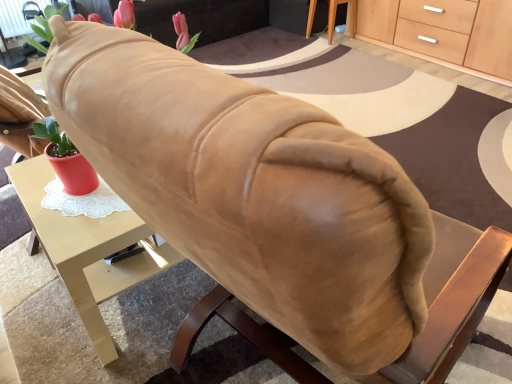
Question: Is suede-like beige couch at upper center oriented towards light wood/wooden cabinet at upper right?

Choices:
 (A) yes
 (B) no

Answer: (A)

Question: Is suede-like beige couch at upper center beside light wood/wooden cabinet at upper right?

Choices:
 (A) no
 (B) yes

Answer: (A)

Question: From the image's perspective, is suede-like beige couch at upper center located above light wood/wooden cabinet at upper right?

Choices:
 (A) no
 (B) yes

Answer: (B)

Question: Is suede-like beige couch at upper center located outside light wood/wooden cabinet at upper right?

Choices:
 (A) no
 (B) yes

Answer: (B)

Question: Can you confirm if suede-like beige couch at upper center is taller than light wood/wooden cabinet at upper right?

Choices:
 (A) no
 (B) yes

Answer: (B)

Question: From the image's perspective, is suede-like beige couch at upper center under light wood/wooden cabinet at upper right?

Choices:
 (A) yes
 (B) no

Answer: (B)

Question: Does suede-like beige couch at upper center have a greater width compared to wooden table at lower right?

Choices:
 (A) yes
 (B) no

Answer: (A)

Question: Is suede-like beige couch at upper center oriented away from wooden table at lower right?

Choices:
 (A) no
 (B) yes

Answer: (A)

Question: Considering the relative sizes of suede-like beige couch at upper center and wooden table at lower right in the image provided, is suede-like beige couch at upper center smaller than wooden table at lower right?

Choices:
 (A) yes
 (B) no

Answer: (B)

Question: Is suede-like beige couch at upper center shorter than wooden table at lower right?

Choices:
 (A) no
 (B) yes

Answer: (A)

Question: Is suede-like beige couch at upper center at the left side of wooden table at lower right?

Choices:
 (A) no
 (B) yes

Answer: (B)

Question: Could you tell me if suede-like beige couch at upper center is turned towards wooden table at lower right?

Choices:
 (A) no
 (B) yes

Answer: (B)

Question: From the image's perspective, is matte gold desk at center located above wooden table at lower right?

Choices:
 (A) no
 (B) yes

Answer: (A)